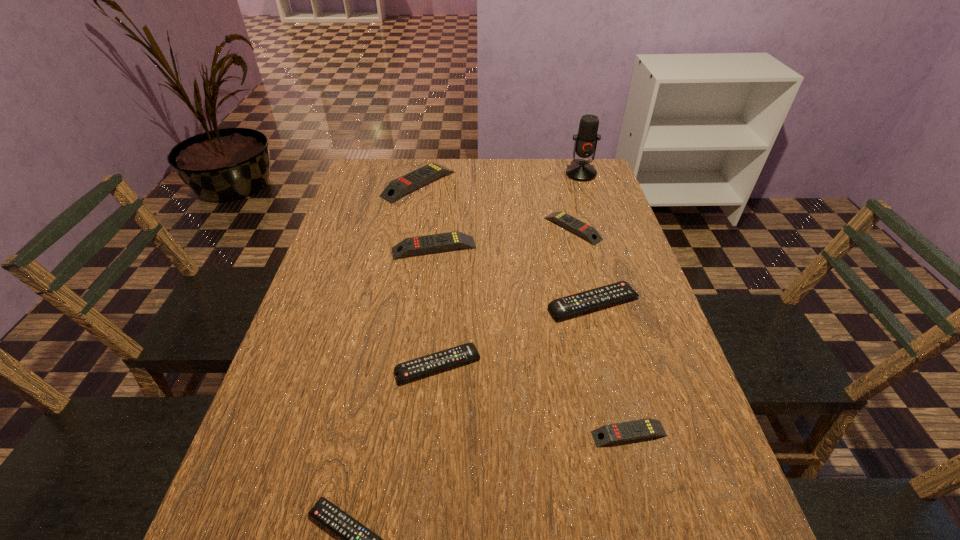
Identify the location of the tallest object. (585, 145).

Locate an element on the screen. The image size is (960, 540). microphone is located at coordinates (585, 145).

The height and width of the screenshot is (540, 960). Identify the location of the seventh shortest object. (397, 188).

Image resolution: width=960 pixels, height=540 pixels. I want to click on the farthest yellow remote control, so click(397, 188).

The image size is (960, 540). Identify the location of the third smallest yellow remote control. (452, 240).

Identify the location of the sixth shortest remote control. This screenshot has height=540, width=960. (452, 240).

This screenshot has height=540, width=960. I want to click on the second smallest yellow remote control, so click(x=586, y=231).

What are the coordinates of `the farthest black remote control` in the screenshot? It's located at (588, 300).

The width and height of the screenshot is (960, 540). Find the location of `the biggest black remote control`. the biggest black remote control is located at coordinates (588, 300).

This screenshot has height=540, width=960. I want to click on the second farthest black remote control, so click(x=444, y=359).